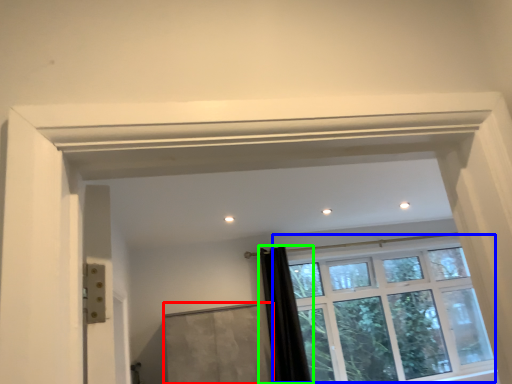
Question: Which is farther away from screen door (highlighted by a red box)? window (highlighted by a blue box) or shower curtain (highlighted by a green box)?

Choices:
 (A) window
 (B) shower curtain

Answer: (A)